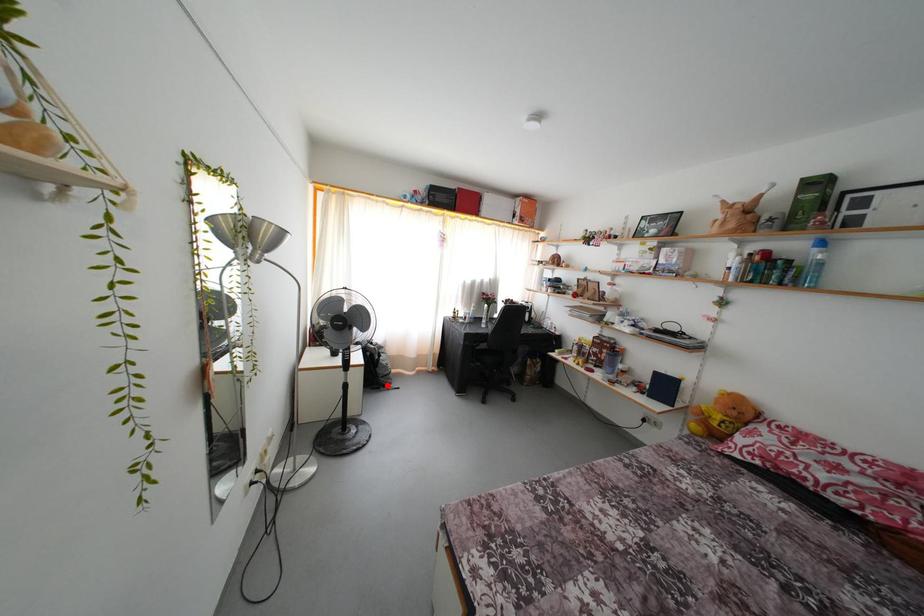
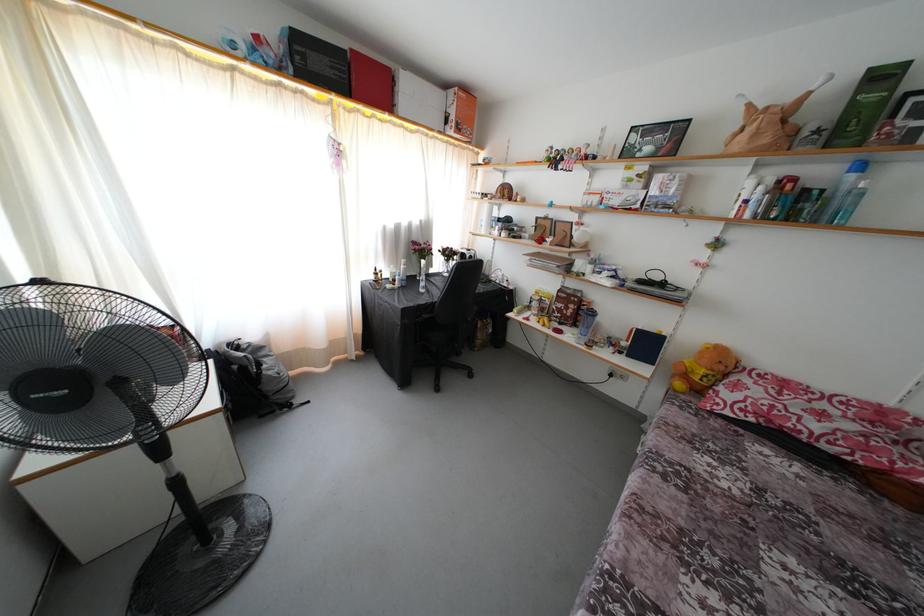
Find the pixel in the second image that matches the highlighted location in the first image.

(281, 403)